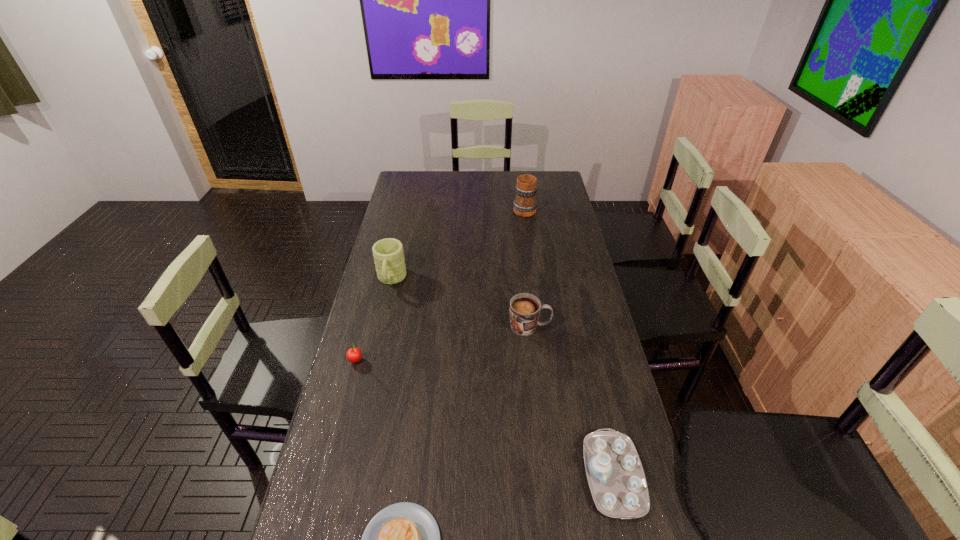
I want to click on the tallest object, so click(525, 204).

At what (x,y) coordinates should I click in order to perform the action: click on the tallest mug. Please return your answer as a coordinate pair (x, y). Looking at the image, I should click on (525, 204).

Where is `the leftmost mug`? This screenshot has width=960, height=540. the leftmost mug is located at coordinates 388,253.

Where is `the second farthest object`? The image size is (960, 540). the second farthest object is located at coordinates (388, 253).

Find the location of `the nearest mug`. the nearest mug is located at coordinates [525, 308].

Identify the location of the third farthest object. (525, 308).

What are the coordinates of `the fourth farthest object` in the screenshot? It's located at (354, 354).

Where is `chinaware`? The height and width of the screenshot is (540, 960). chinaware is located at coordinates (616, 478).

You are a GUI agent. You are given a task and a screenshot of the screen. Output one action in this format:
    pyautogui.click(x=<x>, y=<y>)
    Task: Click on the vacant space positioned on the side of the farthest object with the handle
    
    Given the screenshot: What is the action you would take?
    pyautogui.click(x=519, y=174)

The image size is (960, 540). In order to click on vacant space situated 0.190m on the side of the farthest object with the handle in this screenshot , I will do click(520, 180).